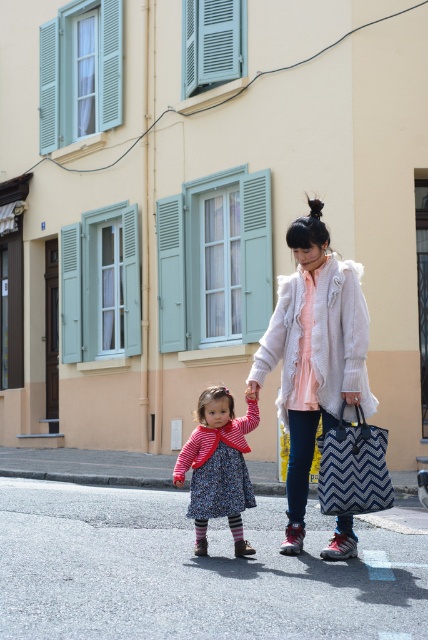
Who is lower down, white fluffy coat at center or blue zigzag-patterned fabric bag at center?

blue zigzag-patterned fabric bag at center is below.

Can you confirm if white fluffy coat at center is positioned above blue zigzag-patterned fabric bag at center?

Indeed, white fluffy coat at center is positioned over blue zigzag-patterned fabric bag at center.

Between point (299, 401) and point (389, 506), which one is positioned in front?

Point (389, 506) is more forward.

This screenshot has height=640, width=428. What are the coordinates of `white fluffy coat at center` in the screenshot? It's located at (314, 353).

Can you confirm if striped knit dress at center is positioned to the left of blue zigzag-patterned fabric bag at center?

Indeed, striped knit dress at center is positioned on the left side of blue zigzag-patterned fabric bag at center.

Who is more distant from viewer, (x=228, y=412) or (x=372, y=442)?

Point (x=228, y=412)

Between point (199, 552) and point (333, 438), which one is positioned in front?

Point (333, 438) is more forward.

I want to click on striped knit dress at center, so click(217, 467).

The width and height of the screenshot is (428, 640). What do you see at coordinates (314, 353) in the screenshot?
I see `white fluffy coat at center` at bounding box center [314, 353].

Can you confirm if white fluffy coat at center is taller than striped knit dress at center?

Indeed, white fluffy coat at center has a greater height compared to striped knit dress at center.

What do you see at coordinates (314, 353) in the screenshot? The width and height of the screenshot is (428, 640). I see `white fluffy coat at center` at bounding box center [314, 353].

I want to click on white fluffy coat at center, so click(314, 353).